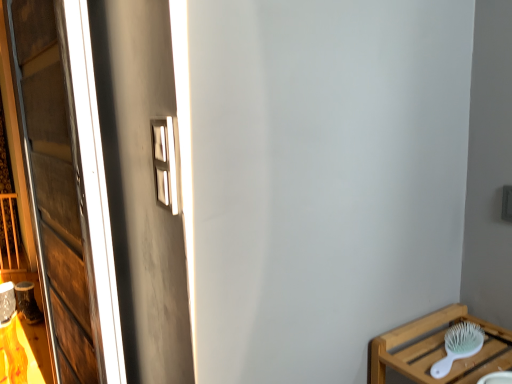
Question: From a real-world perspective, is wooden window at left physically located above or below white plastic brush at lower right?

Choices:
 (A) above
 (B) below

Answer: (A)

Question: Is wooden window at left wider or thinner than white plastic brush at lower right?

Choices:
 (A) thin
 (B) wide

Answer: (A)

Question: Is wooden window at left situated inside white plastic brush at lower right or outside?

Choices:
 (A) inside
 (B) outside

Answer: (B)

Question: Visually, is white plastic brush at lower right positioned to the left or to the right of wooden window at left?

Choices:
 (A) left
 (B) right

Answer: (B)

Question: Considering the positions of point (476, 336) and point (92, 276), is point (476, 336) closer or farther from the camera than point (92, 276)?

Choices:
 (A) closer
 (B) farther

Answer: (A)

Question: From the image's perspective, is white plastic brush at lower right positioned above or below wooden window at left?

Choices:
 (A) above
 (B) below

Answer: (B)

Question: Is white plastic brush at lower right spatially inside wooden window at left, or outside of it?

Choices:
 (A) outside
 (B) inside

Answer: (A)